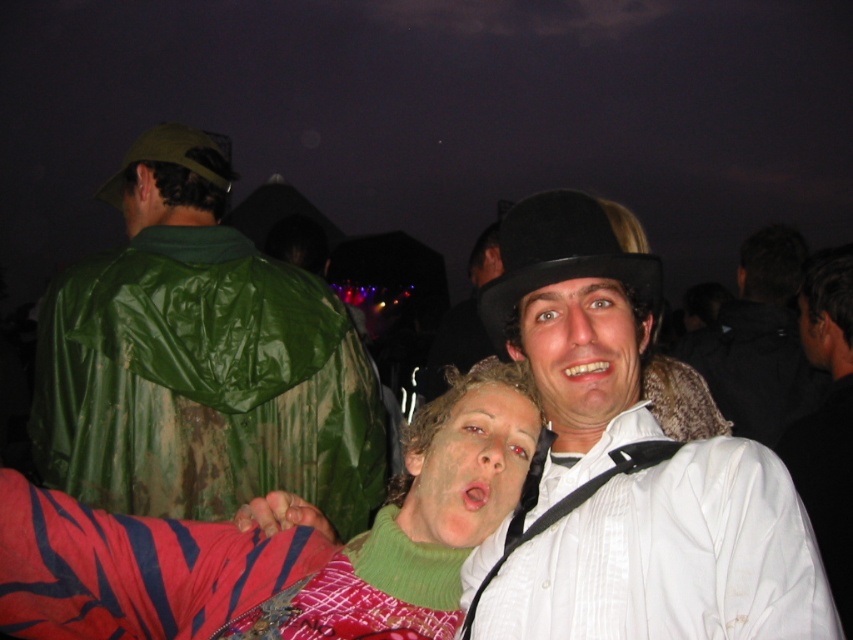
Is green fuzzy sweater at center to the right of white glossy shirt at right from the viewer's perspective?

Incorrect, green fuzzy sweater at center is not on the right side of white glossy shirt at right.

Measure the distance between green fuzzy sweater at center and camera.

2.12 meters

Identify the location of green fuzzy sweater at center. (277, 547).

Is white glossy shirt at right to the right of smooth skin face at center from the viewer's perspective?

In fact, white glossy shirt at right is to the left of smooth skin face at center.

Does white glossy shirt at right have a larger size compared to smooth skin face at center?

Indeed, white glossy shirt at right has a larger size compared to smooth skin face at center.

Is point (827, 506) less distant than point (840, 365)?

Yes, point (827, 506) is in front of point (840, 365).

Locate an element on the screen. The image size is (853, 640). white glossy shirt at right is located at coordinates (827, 420).

Based on the photo, which is below, green fuzzy sweater at center or green knit sweater at center?

Positioned lower is green fuzzy sweater at center.

Between point (28, 545) and point (508, 390), which one is positioned behind?

The point (508, 390) is behind.

Find the location of a particular element. green fuzzy sweater at center is located at coordinates (277, 547).